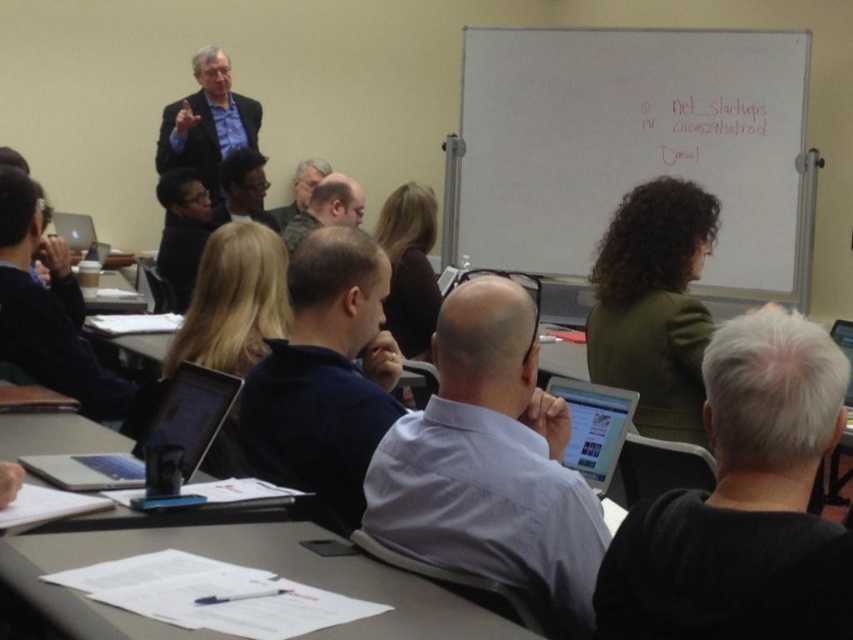
Question: Is white paper at lower center below blue shirt at upper left?

Choices:
 (A) no
 (B) yes

Answer: (B)

Question: Which object appears farthest from the camera in this image?

Choices:
 (A) gray hair at center
 (B) dark blue sweater at center
 (C) silver metallic laptop at center
 (D) dark gray shirt at center

Answer: (A)

Question: Considering the relative positions of black matte shirt at lower right and silver metallic laptop at center in the image provided, where is black matte shirt at lower right located with respect to silver metallic laptop at center?

Choices:
 (A) right
 (B) left

Answer: (A)

Question: Where is dark gray shirt at center located in relation to gray hair at center in the image?

Choices:
 (A) above
 (B) below

Answer: (B)

Question: Among these objects, which one is farthest from the camera?

Choices:
 (A) black matte shirt at lower right
 (B) blue shirt at upper left
 (C) dark blue sweater at center
 (D) silver metallic laptop at center

Answer: (B)

Question: Which point is farther from the camera taking this photo?

Choices:
 (A) (283, 236)
 (B) (67, 480)
 (C) (563, 387)
 (D) (300, 188)

Answer: (D)